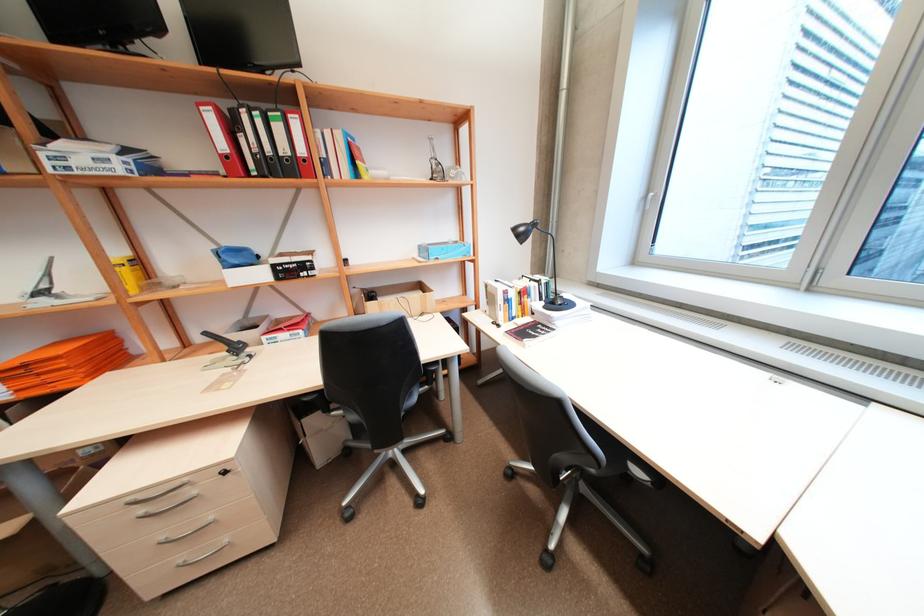
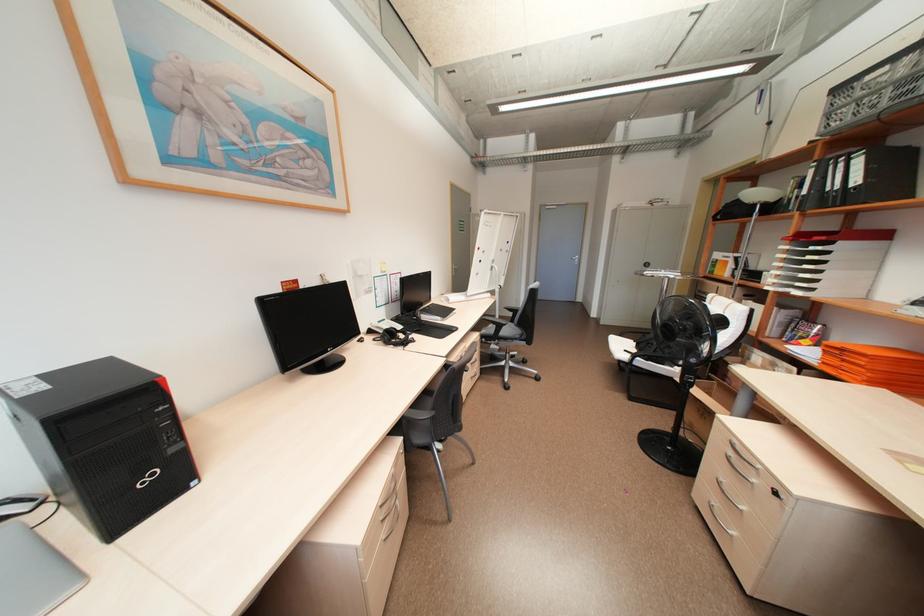
The point at (x=189, y=565) is marked in the first image. Where is the corresponding point in the second image?

(716, 506)